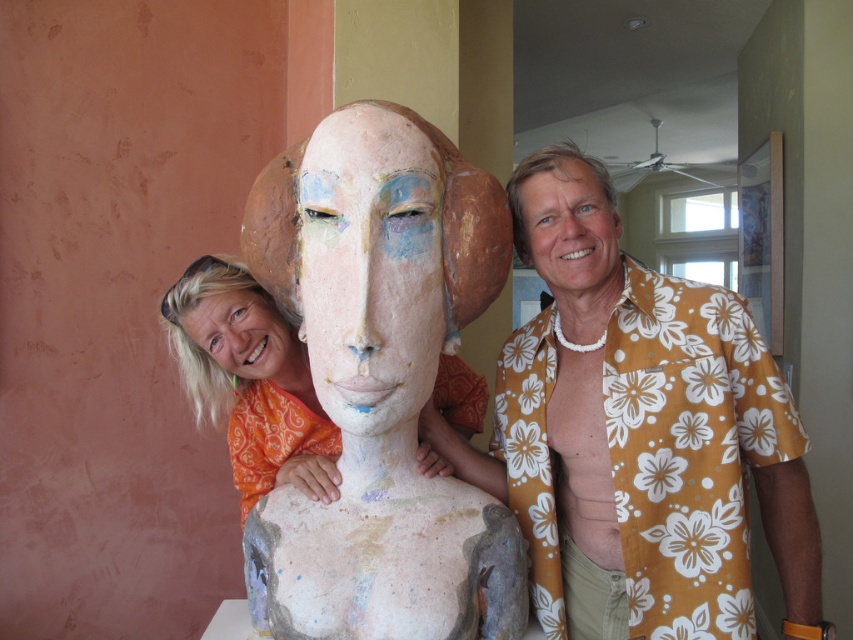
You are standing in front of the sculpture and want to place a small flower pot exactly at the point marked as point (380,384). According to the scene description, what object will the flower pot be placed on?

The flower pot will be placed on the matte clay bust at center located at point (380,384).

You are standing in front of the sculpture and want to take a photo of the yellow floral shirt at right. Where should you position yourself to capture the shirt in the frame?

Position yourself so that the yellow floral shirt at right is centered at the coordinates approximately 0.678 on the x and 0.754 on the y axis to capture it in the frame.

You are a photographer trying to capture a photo of the matte clay mask at center. You notice the yellow floral shirt at right is blocking part of the mask. Based on their heights, can you determine if you need to adjust your camera angle upwards or downwards to avoid the obstruction?

The yellow floral shirt at right is taller than matte clay mask at center, so you need to adjust your camera angle downwards to avoid the obstruction caused by the taller shirt.